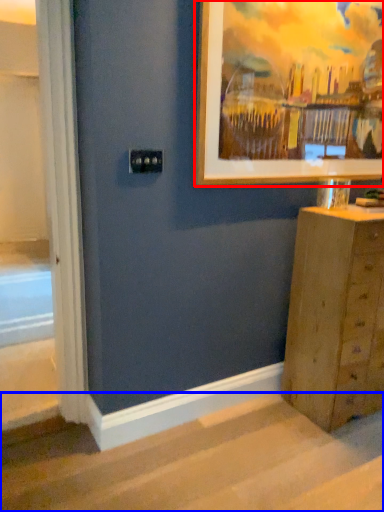
Question: Which object is closer to the camera taking this photo, picture frame (highlighted by a red box) or stairwell (highlighted by a blue box)?

Choices:
 (A) picture frame
 (B) stairwell

Answer: (B)